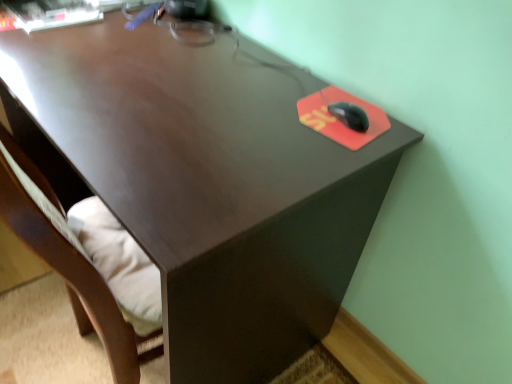
In order to click on brown wood swivel chair at lower left in this screenshot , I will do `click(67, 262)`.

The width and height of the screenshot is (512, 384). Describe the element at coordinates (67, 262) in the screenshot. I see `brown wood swivel chair at lower left` at that location.

Where is `brown wood swivel chair at lower left`? The image size is (512, 384). brown wood swivel chair at lower left is located at coordinates (67, 262).